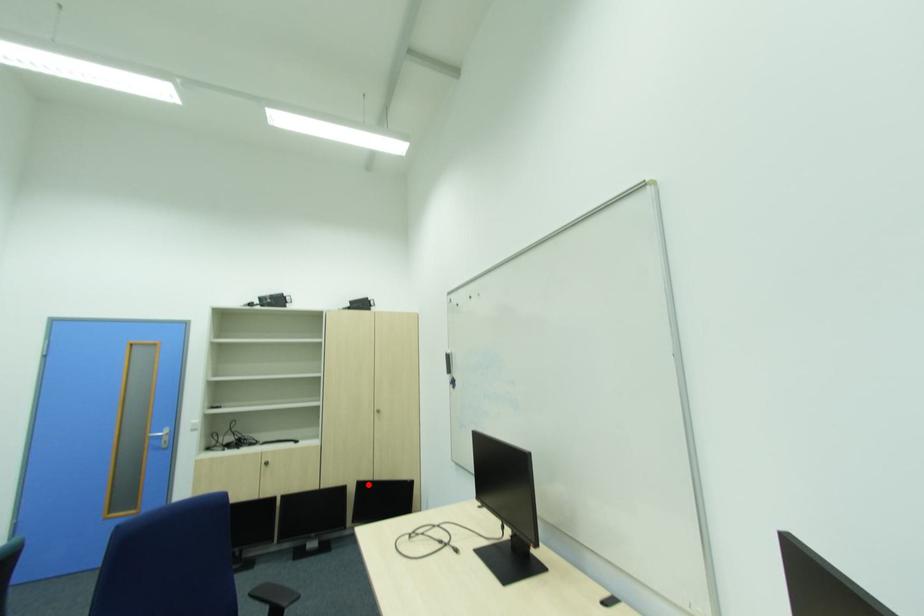
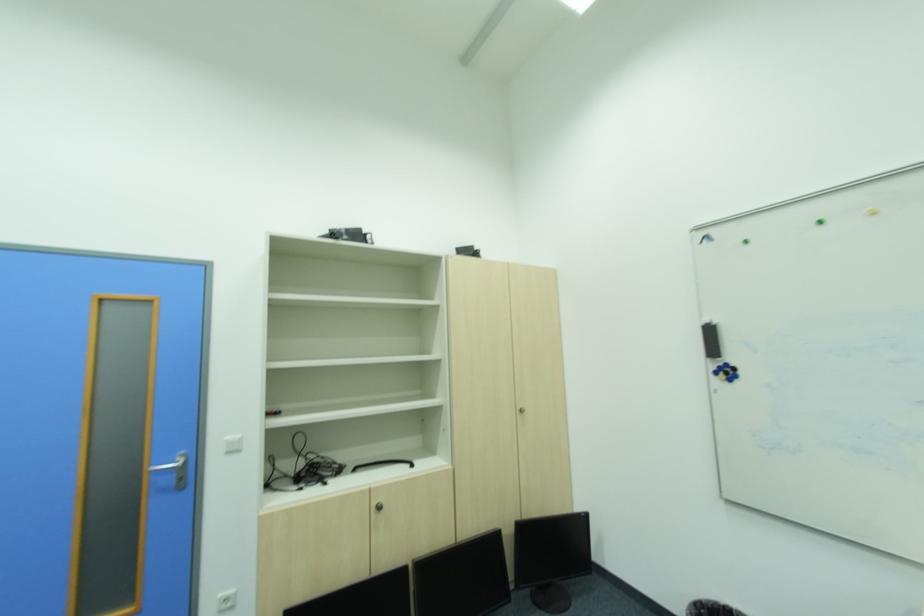
Question: I am providing you with two images of the same scene from different viewpoints. A red point is shown in image1. For the corresponding object point in image2, is it positioned nearer or farther from the camera?

Choices:
 (A) Nearer
 (B) Farther

Answer: (A)